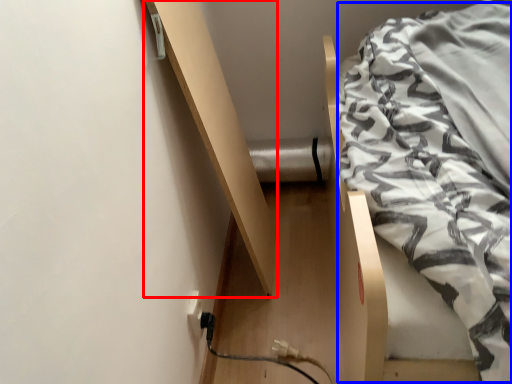
Question: Which object is further to the camera taking this photo, shelf (highlighted by a red box) or blanket (highlighted by a blue box)?

Choices:
 (A) shelf
 (B) blanket

Answer: (A)